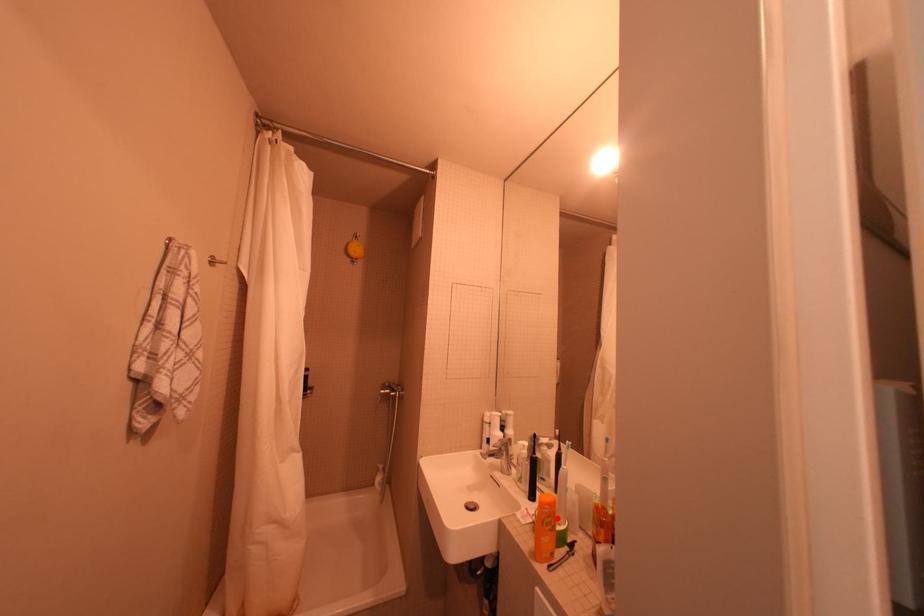
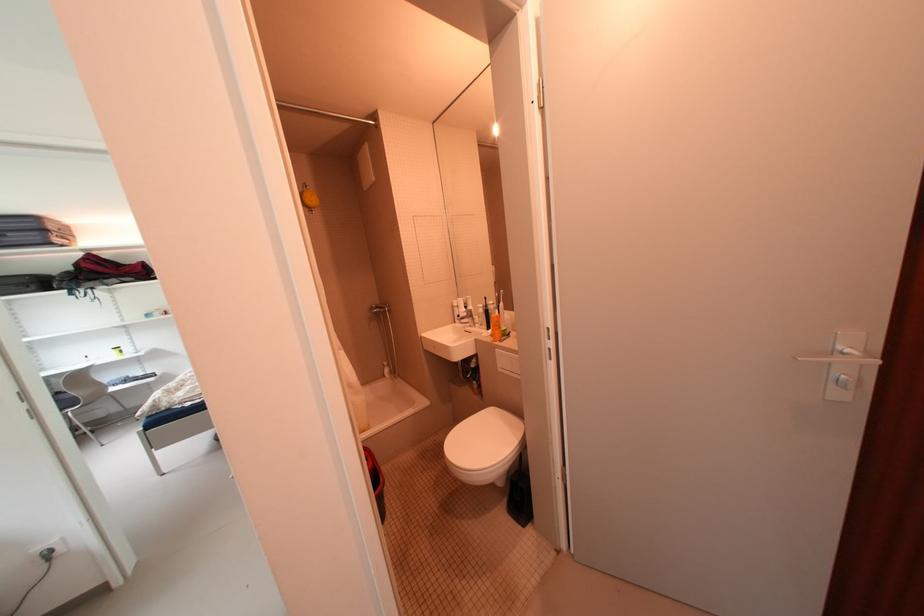
In the second image, find the point that corresponds to the highlighted location in the first image.

(505, 323)